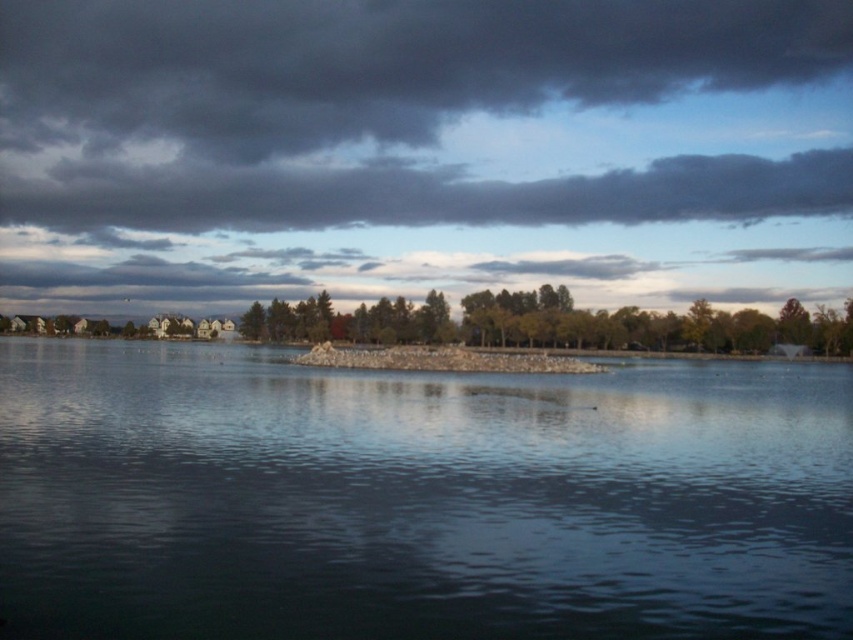
This screenshot has width=853, height=640. What do you see at coordinates (381, 61) in the screenshot?
I see `dark gray cloud at upper center` at bounding box center [381, 61].

Does point (183, 58) lie behind point (776, 337)?

Yes, point (183, 58) is farther from viewer.

Is point (207, 17) farther from viewer compared to point (784, 301)?

Yes.

You are a GUI agent. You are given a task and a screenshot of the screen. Output one action in this format:
    pyautogui.click(x=<x>, y=<y>)
    Task: Click on the dark gray cloud at upper center
    The height and width of the screenshot is (640, 853).
    Given the screenshot: What is the action you would take?
    pyautogui.click(x=381, y=61)

Can you confirm if transparent water at center is thinner than dark gray cloud at upper center?

Indeed, transparent water at center has a lesser width compared to dark gray cloud at upper center.

Is point (657, 429) behind point (308, 93)?

No, it is not.

Is point (202, 596) less distant than point (531, 38)?

Yes, point (202, 596) is in front of point (531, 38).

Find the location of a particular element. This screenshot has height=640, width=853. transparent water at center is located at coordinates (416, 499).

Can you confirm if green leafy trees at center is shorter than green matte tree at upper right?

No, green leafy trees at center is not shorter than green matte tree at upper right.

Is green leafy trees at center wider than green matte tree at upper right?

Indeed, green leafy trees at center has a greater width compared to green matte tree at upper right.

Who is more distant from viewer, (x=546, y=285) or (x=798, y=337)?

The point (x=546, y=285) is more distant.

Find the location of a particular element. The image size is (853, 640). green leafy trees at center is located at coordinates (512, 323).